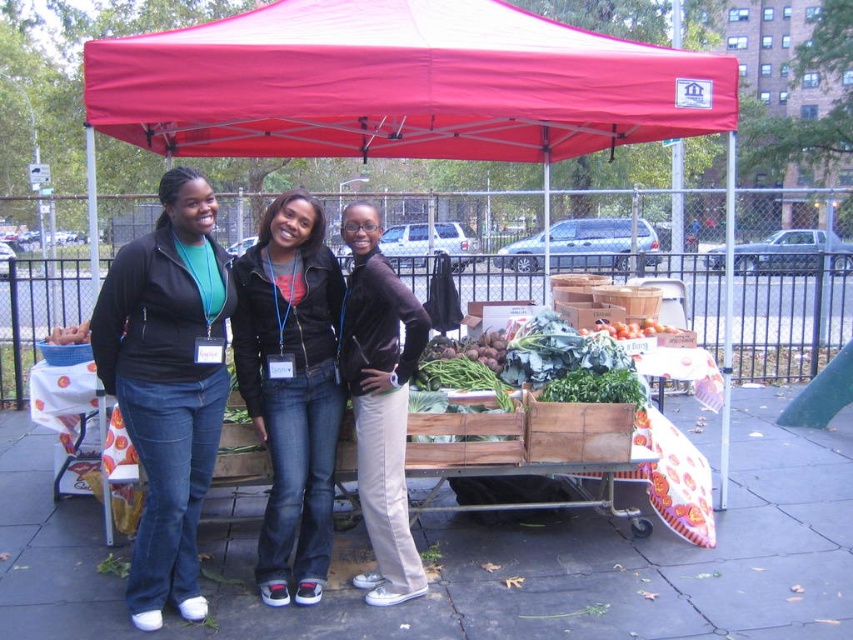
Question: Does denim jeans at center lie behind brown suede jacket at center?

Choices:
 (A) no
 (B) yes

Answer: (B)

Question: Among these objects, which one is nearest to the camera?

Choices:
 (A) smooth concrete pavement at center
 (B) ripe red tomatoes at center
 (C) denim jeans at center

Answer: (A)

Question: Which object is closer to the camera taking this photo?

Choices:
 (A) brown suede jacket at center
 (B) denim jeans at center

Answer: (A)

Question: Which of the following is the farthest from the observer?

Choices:
 (A) (846, 538)
 (B) (688, 113)
 (C) (322, 419)
 (D) (201, 192)

Answer: (A)

Question: Does smooth concrete pavement at center have a smaller size compared to denim jeans at center?

Choices:
 (A) no
 (B) yes

Answer: (B)

Question: Does matte black jacket at center appear over ripe red tomatoes at center?

Choices:
 (A) no
 (B) yes

Answer: (A)